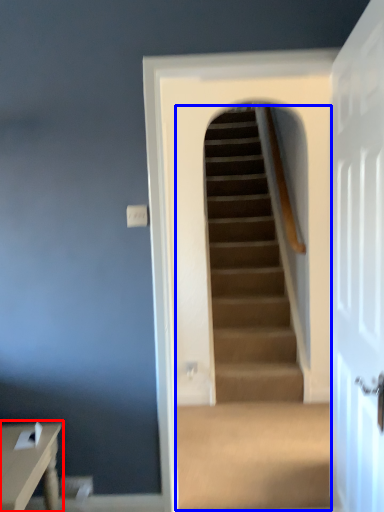
Question: Among these objects, which one is nearest to the camera, table (highlighted by a red box) or escalator (highlighted by a blue box)?

Choices:
 (A) table
 (B) escalator

Answer: (A)